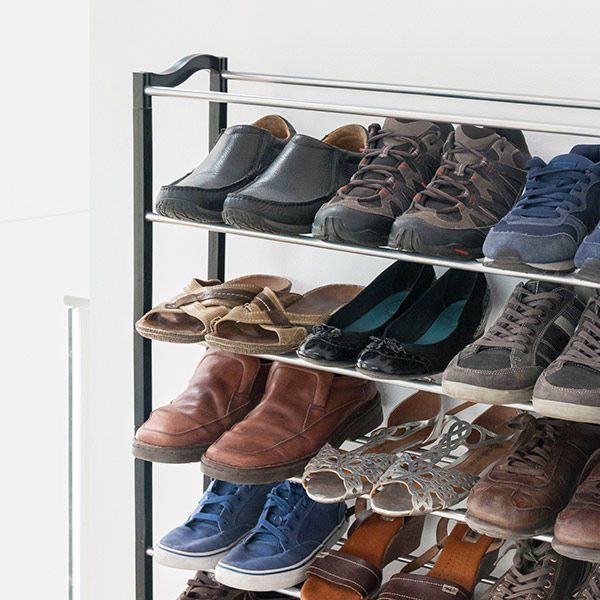
Find the location of a particular element. This screenshot has width=600, height=600. shoes second shelf is located at coordinates (209, 531), (272, 545), (352, 559), (455, 568), (530, 578), (594, 591).